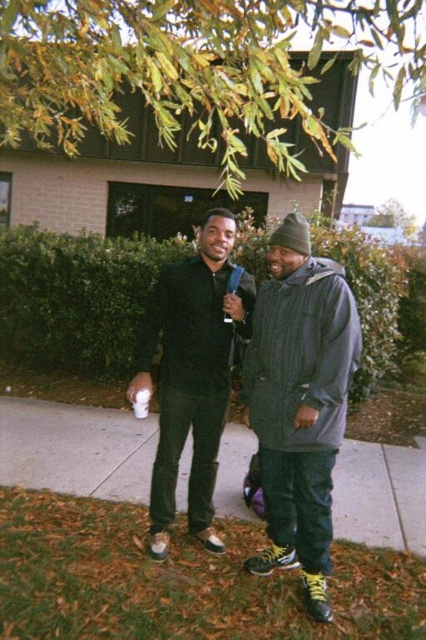
Question: Does green leafy tree at upper center have a larger size compared to matte black jacket at center?

Choices:
 (A) no
 (B) yes

Answer: (A)

Question: Is green leafy tree at upper center above matte black jacket at center?

Choices:
 (A) no
 (B) yes

Answer: (B)

Question: Which point appears farthest from the camera in this image?

Choices:
 (A) (86, 435)
 (B) (344, 305)

Answer: (A)

Question: Which object is positioned closest to the matte black pants at lower center?

Choices:
 (A) green leafy tree at upper center
 (B) matte black shirt at center
 (C) matte black jacket at center

Answer: (B)

Question: Which object appears closest to the camera in this image?

Choices:
 (A) green leafy tree at upper center
 (B) matte black pants at lower center
 (C) matte black jacket at center

Answer: (A)

Question: In this image, where is matte black jacket at center located relative to matte black shirt at center?

Choices:
 (A) right
 (B) left

Answer: (A)